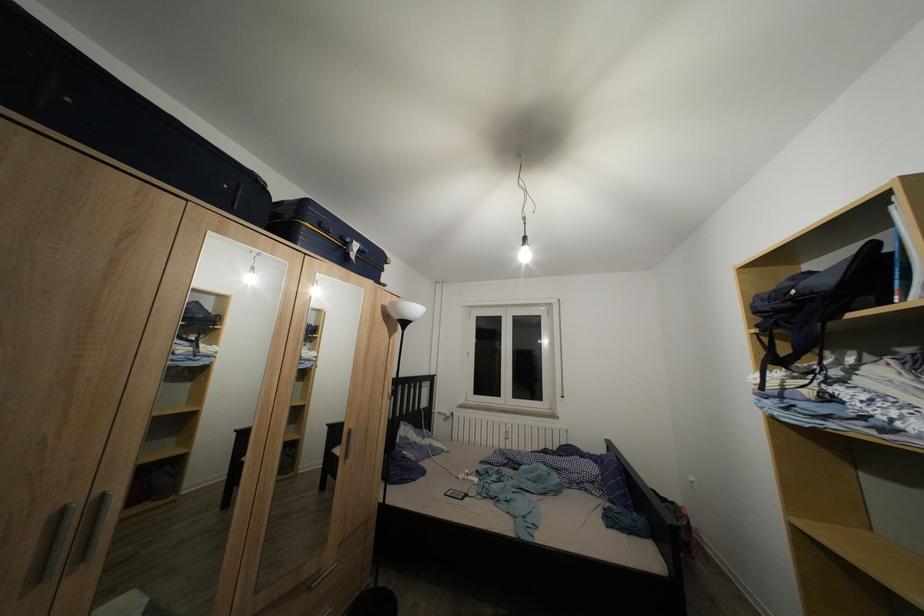
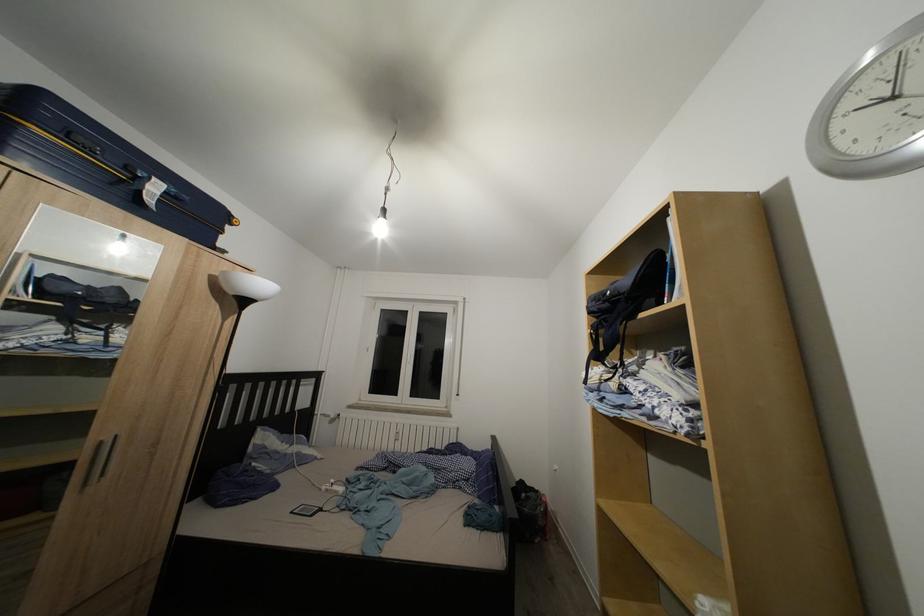
Locate, in the second image, the point that corresponds to point 774,315 in the first image.

(602, 315)